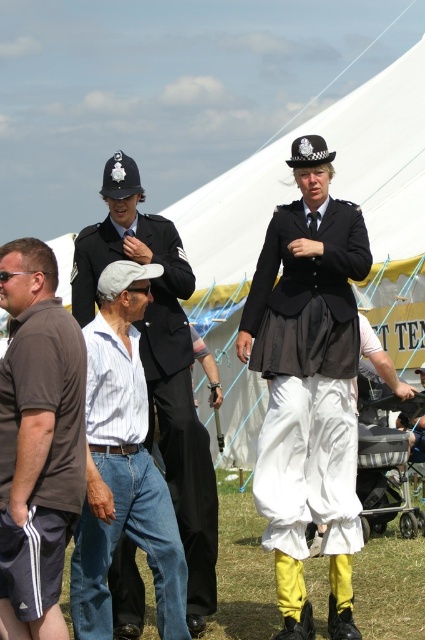
In the scene with the two police officers on stilts, you notice a black satin skirt at center and a brown cotton shirt at lower left. Which object is positioned more to the right?

The black satin skirt at center is positioned more to the right than the brown cotton shirt at lower left.

You are a costume designer trying to determine the spatial relationship between the two central costumes in the image. Which of the two, the black satin skirt at center or the black fabric uniform at center, is shorter in height?

The black satin skirt at center is not as tall as the black fabric uniform at center, so the black satin skirt at center is shorter in height.

Based on the photo, you are a photographer trying to capture the scene. You notice a point at coordinates (x=37, y=433). Which object is this point located on?

The point at coordinates (x=37, y=433) is located on the brown cotton shirt at lower left.